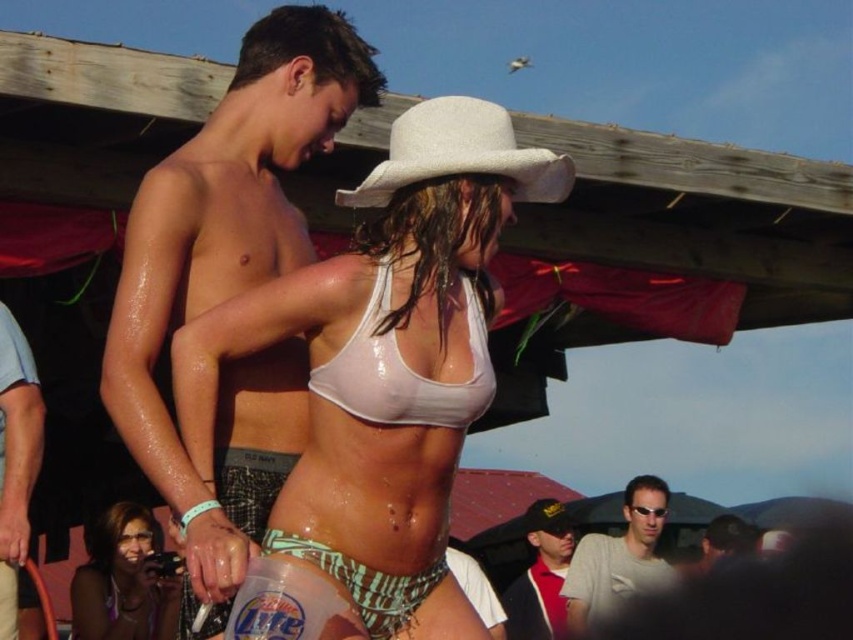
Question: Does matte white camera at center lie in front of gray fabric sunglasses at center?

Choices:
 (A) yes
 (B) no

Answer: (A)

Question: Does white straw cowboy hat at center appear under matte white camera at center?

Choices:
 (A) no
 (B) yes

Answer: (A)

Question: Which object appears closest to the camera in this image?

Choices:
 (A) white straw cowboy hat at center
 (B) blue cotton shirt at left
 (C) white matte hat at upper center
 (D) matte white camera at center

Answer: (C)

Question: Estimate the real-world distances between objects in this image. Which object is farther from the matte white camera at center?

Choices:
 (A) dark blue baseball cap at lower center
 (B) black fabric hat at center

Answer: (B)

Question: Based on their relative distances, which object is farther from the gray fabric sunglasses at center?

Choices:
 (A) white straw cowboy hat at center
 (B) dark blue baseball cap at lower center
 (C) blue cotton shirt at left
 (D) shiny black skin at upper center

Answer: (D)

Question: From the image, what is the correct spatial relationship of blue cotton shirt at left in relation to black fabric hat at center?

Choices:
 (A) above
 (B) below

Answer: (A)